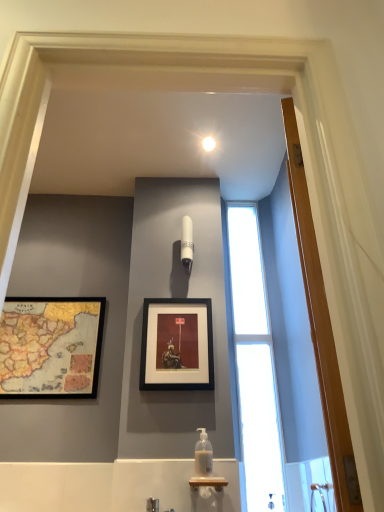
Where is `free space in front of white glossy light fixture at upper center`? This screenshot has height=512, width=384. free space in front of white glossy light fixture at upper center is located at coordinates (220, 129).